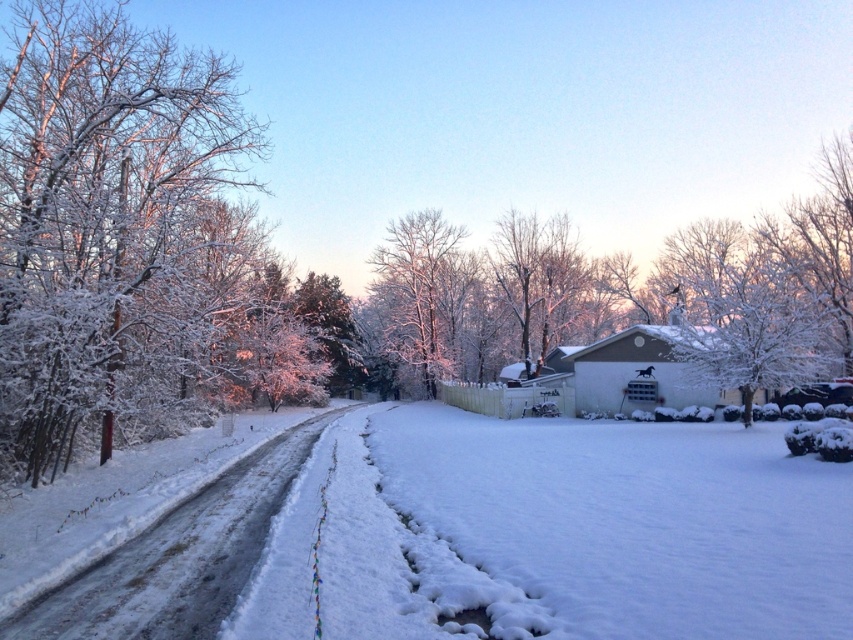
You are standing on the snow covered road and want to take a photo of both the white fluffy snow at center and the white frosty branches at left. Which object will appear larger in your camera viewfinder?

The white fluffy snow at center will appear larger in your camera viewfinder because it is closer to the viewer than the white frosty branches at left.

You are planning to build a snowman using the white fluffy snow at center and the white frosty branches at left. Which material would you have more of to use?

The white frosty branches at left occupy more space than the white fluffy snow at center, so you would have more of the white frosty branches at left to use.

You are standing at the center of the snow covered road in the image. Looking towards the left side, you see a point marked at coordinates (105, 221). What object is located at that point?

The point at (105, 221) indicates white frosty branches at left.